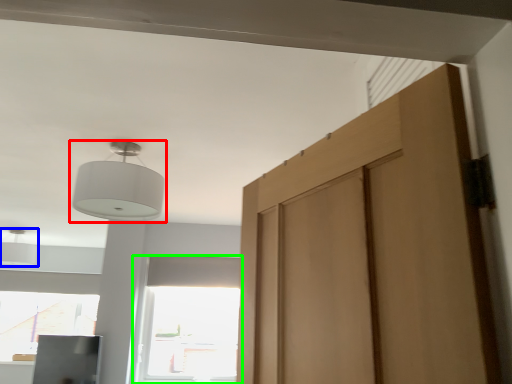
Question: Based on their relative distances, which object is farther from lamp (highlighted by a red box)? Choose from light (highlighted by a blue box) and window (highlighted by a green box).

Choices:
 (A) light
 (B) window

Answer: (A)